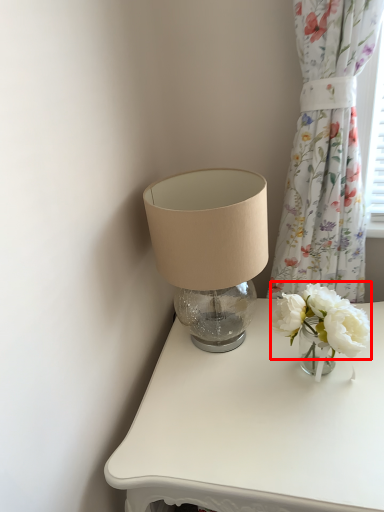
Question: From the image's perspective, what is the correct spatial positioning of flower (annotated by the red box) in reference to curtain?

Choices:
 (A) above
 (B) below

Answer: (B)